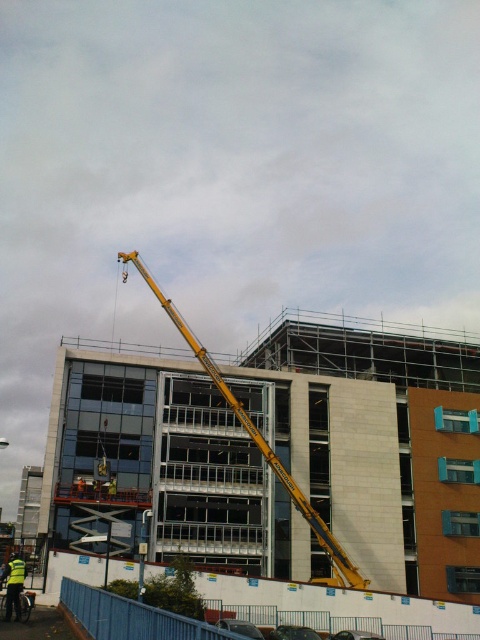
Which is above, yellow metallic crane at center or yellow reflective vest at lower left?

yellow metallic crane at center is above.

Which is in front, point (181, 332) or point (16, 602)?

Positioned in front is point (16, 602).

Does point (315, 524) come in front of point (20, 566)?

No, it is behind (20, 566).

In order to click on yellow metallic crane at center in this screenshot , I will do `click(261, 445)`.